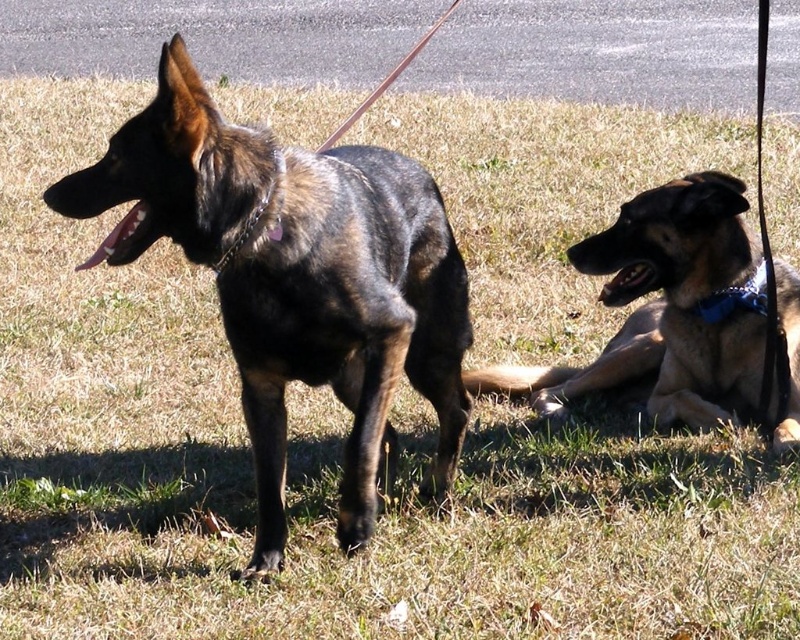
Question: Observing the image, what is the correct spatial positioning of brindle fur dog at center in reference to blue fabric neckband at right?

Choices:
 (A) left
 (B) right

Answer: (A)

Question: Which object is farther from the camera taking this photo?

Choices:
 (A) brindle fur dog at center
 (B) blue fabric neckband at right

Answer: (B)

Question: Considering the real-world distances, which object is farthest from the brindle fur dog at center?

Choices:
 (A) blue fabric neckband at right
 (B) brown fur dog at lower right

Answer: (A)

Question: Can you confirm if brindle fur dog at center is smaller than blue fabric neckband at right?

Choices:
 (A) yes
 (B) no

Answer: (B)

Question: Considering the relative positions of brindle fur dog at center and blue fabric neckband at right in the image provided, where is brindle fur dog at center located with respect to blue fabric neckband at right?

Choices:
 (A) left
 (B) right

Answer: (A)

Question: Considering the real-world distances, which object is farthest from the brown fur dog at lower right?

Choices:
 (A) blue fabric neckband at right
 (B) brindle fur dog at center

Answer: (B)